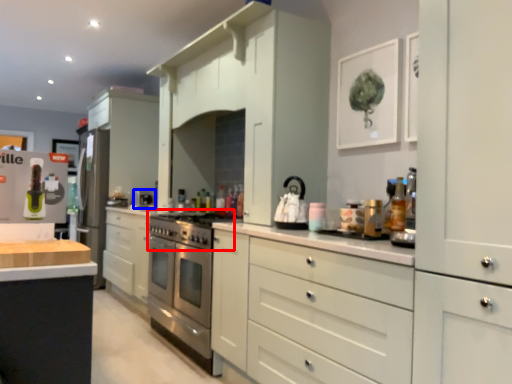
Question: Which object is further to the camera taking this photo, gas stove (highlighted by a red box) or appliance (highlighted by a blue box)?

Choices:
 (A) gas stove
 (B) appliance

Answer: (B)